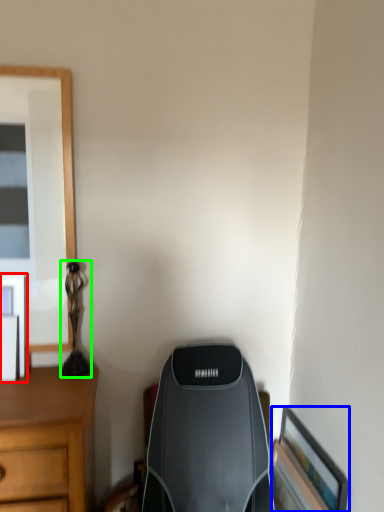
Question: Which object is the farthest from picture frame (highlighted by a red box)? Choose among these: picture frame (highlighted by a blue box) or table lamp (highlighted by a green box).

Choices:
 (A) picture frame
 (B) table lamp

Answer: (A)